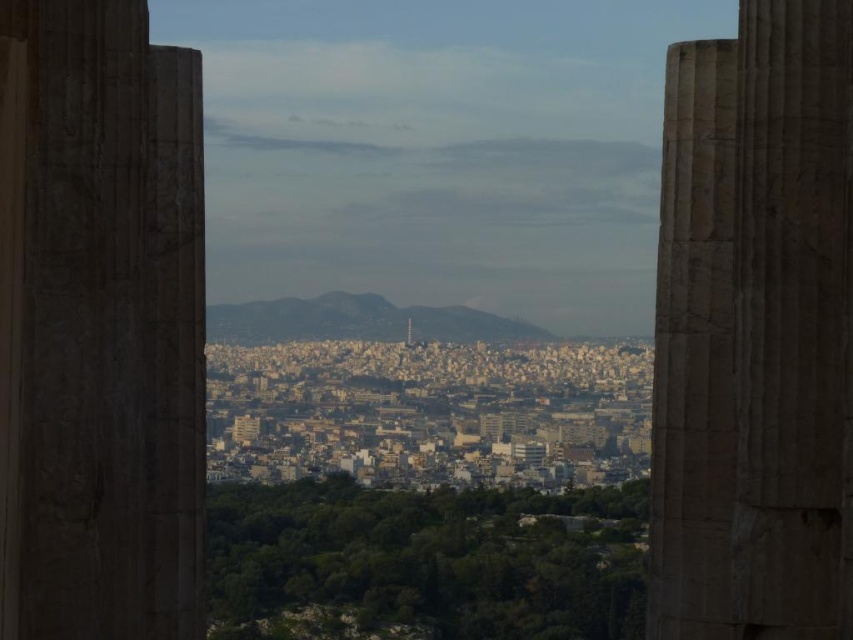
Question: Which of the following is the farthest from the observer?

Choices:
 (A) marble column at right
 (B) carved stone column at left

Answer: (A)

Question: Which of the following is the closest to the observer?

Choices:
 (A) (744, 301)
 (B) (200, 218)
 (C) (657, 323)

Answer: (B)

Question: Is marble column at center to the right of marble column at right from the viewer's perspective?

Choices:
 (A) yes
 (B) no

Answer: (A)

Question: Which of these objects is positioned farthest from the marble column at right?

Choices:
 (A) carved stone column at left
 (B) marble column at center

Answer: (A)

Question: Is carved stone column at left positioned behind marble column at right?

Choices:
 (A) no
 (B) yes

Answer: (A)

Question: Does carved stone column at left appear under marble column at center?

Choices:
 (A) yes
 (B) no

Answer: (B)